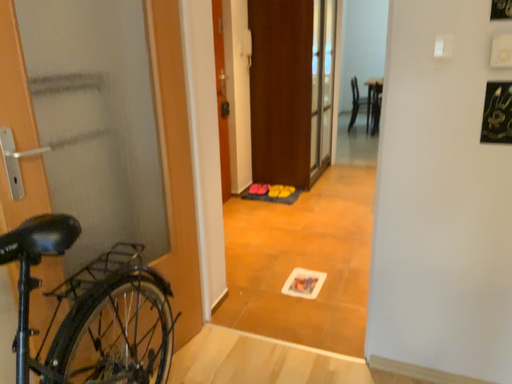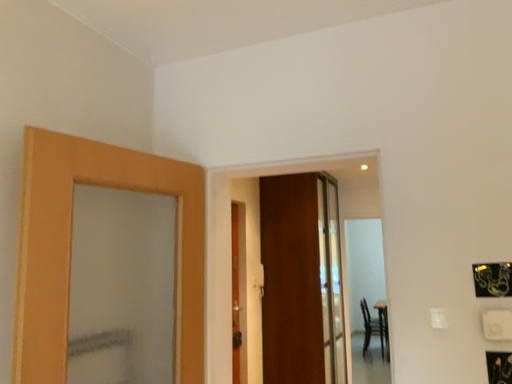
Question: Which way did the camera rotate in the video?

Choices:
 (A) rotated upward
 (B) rotated downward

Answer: (A)